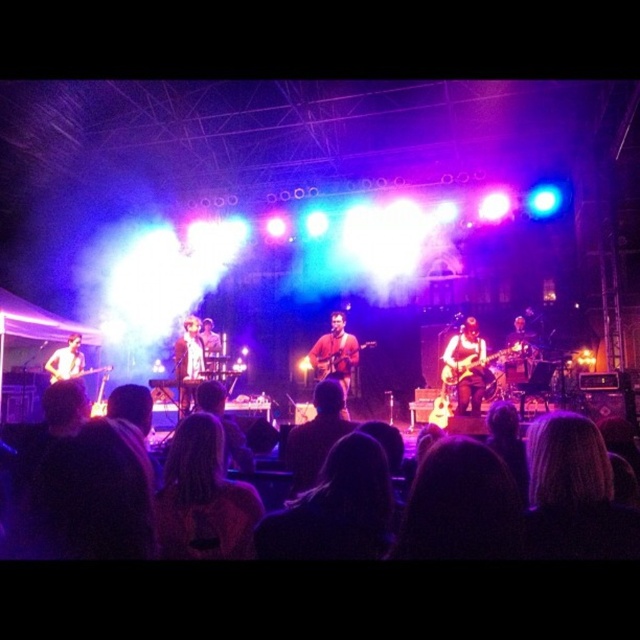
You are a photographer at the concert. You want to capture a closeup shot of the black hair at lower center and the glossy electric guitar at center. Which object should you zoom in more on to ensure both are in frame?

The black hair at lower center is smaller than the glossy electric guitar at center, so you should zoom in more on the glossy electric guitar at center to ensure both are in frame.

You are a stagehand who needs to place a new microphone stand at the point marked as point (x=336, y=355). According to the scene description, what object is located at that point?

The point (x=336, y=355) corresponds to the wooden acoustic guitar at center, so placing the microphone stand there would interfere with the musician playing the instrument.